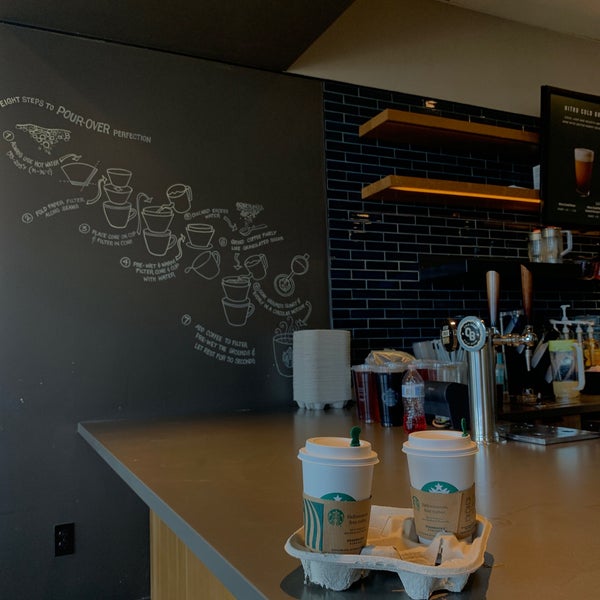
Where is `blue brick wall`? Image resolution: width=600 pixels, height=600 pixels. blue brick wall is located at coordinates (424, 228).